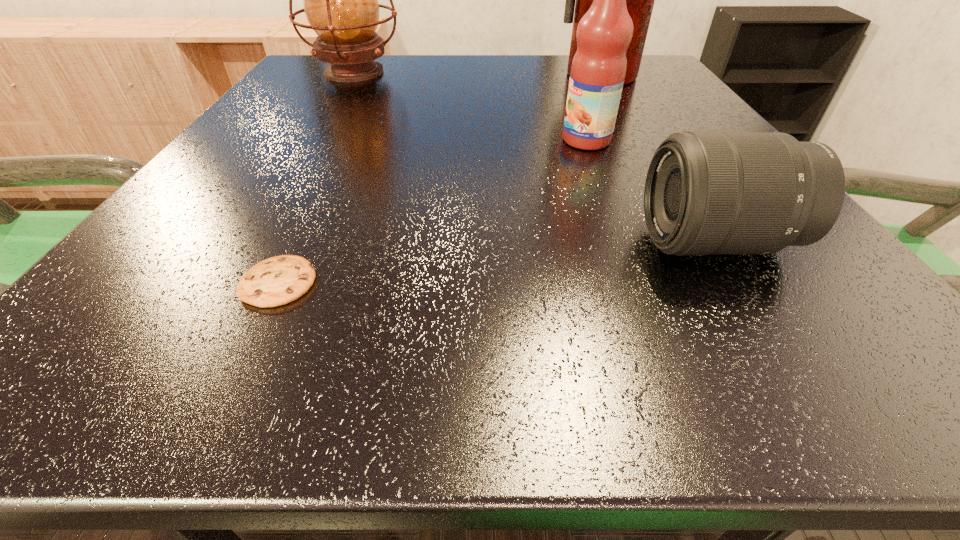
Locate an element on the screen. This screenshot has height=540, width=960. the tallest object is located at coordinates (640, 0).

The width and height of the screenshot is (960, 540). I want to click on oil lamp, so click(340, 0).

Find the location of a particular element. the third nearest object is located at coordinates (598, 69).

Where is `the third shortest object`? The width and height of the screenshot is (960, 540). the third shortest object is located at coordinates (598, 69).

At what (x,y) coordinates should I click in order to perform the action: click on telephoto lens. Please return your answer as a coordinate pair (x, y). Looking at the image, I should click on (706, 192).

Identify the location of cookie. The width and height of the screenshot is (960, 540). (279, 280).

You are a GUI agent. You are given a task and a screenshot of the screen. Output one action in this format:
    pyautogui.click(x=<x>, y=<y>)
    Task: Click on the free spot located 0.360m on the side of the tallest object with the handle and hose
    Image resolution: width=960 pixels, height=540 pixels.
    Given the screenshot: What is the action you would take?
    [660, 179]

You are a GUI agent. You are given a task and a screenshot of the screen. Output one action in this format:
    pyautogui.click(x=<x>, y=<y>)
    Task: Click on the vacant space located on the right of the oil lamp
    This screenshot has height=540, width=960.
    Given the screenshot: What is the action you would take?
    pyautogui.click(x=539, y=72)

Identify the location of free space located 0.060m on the front label of the fruit juice. (526, 140).

You are a GUI agent. You are given a task and a screenshot of the screen. Output one action in this format:
    pyautogui.click(x=<x>, y=<y>)
    Task: Click on the vacant space located on the front label of the fruit juice
    This screenshot has width=960, height=540.
    Given the screenshot: What is the action you would take?
    pyautogui.click(x=484, y=140)